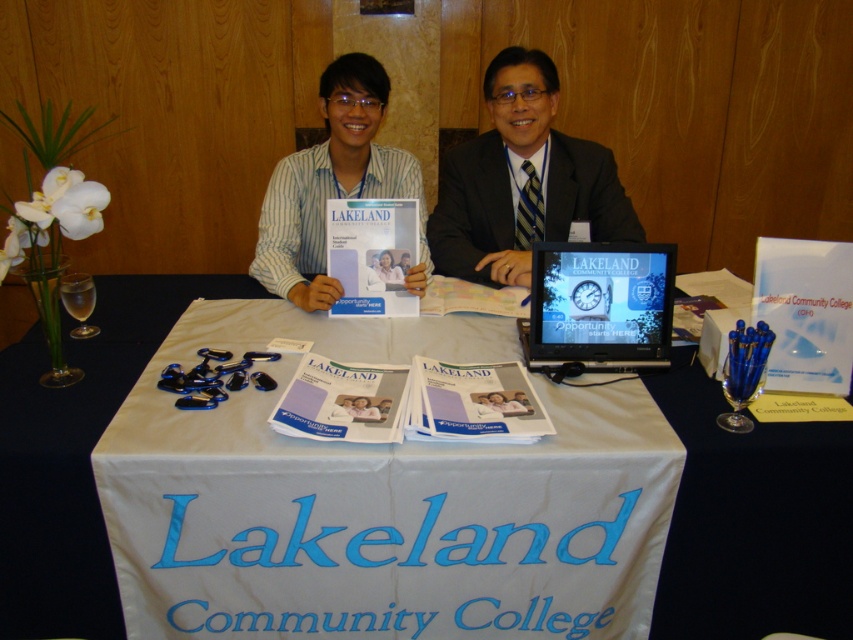
Question: Which point is farther to the camera?

Choices:
 (A) (654, 340)
 (B) (389, 272)
 (C) (405, 600)
 (D) (329, 298)

Answer: (B)

Question: Which point is farther to the camera?

Choices:
 (A) (277, 284)
 (B) (345, 86)

Answer: (A)

Question: Is white paper at center wider than matte black suit at center?

Choices:
 (A) no
 (B) yes

Answer: (B)

Question: Which object appears closest to the camera in this image?

Choices:
 (A) white striped shirt at center
 (B) black glossy monitor at center
 (C) white paper at center

Answer: (B)

Question: Does white striped shirt at center come behind black glossy monitor at center?

Choices:
 (A) no
 (B) yes

Answer: (B)

Question: Does white fabric at center appear over matte white paper at center?

Choices:
 (A) no
 (B) yes

Answer: (A)